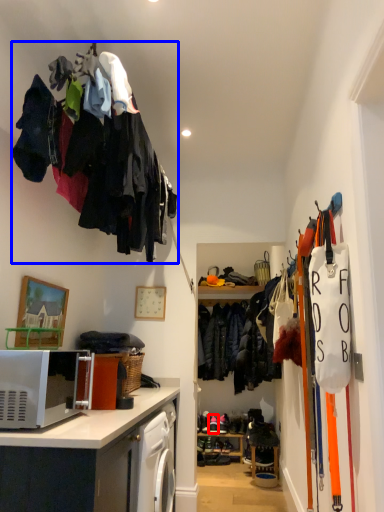
Question: Which object is closer to the camera taking this photo, footwear (highlighted by a red box) or clothing (highlighted by a blue box)?

Choices:
 (A) footwear
 (B) clothing

Answer: (B)